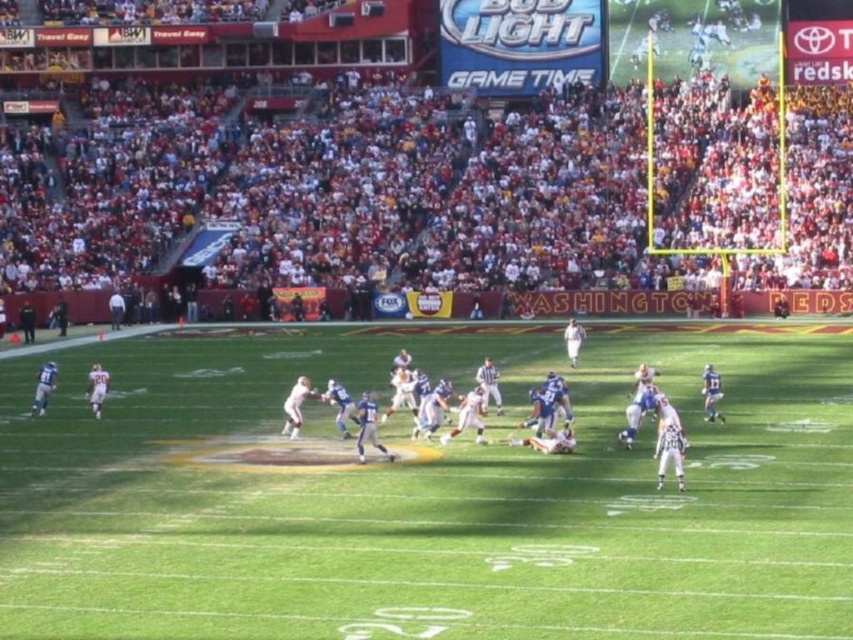
Is green grass football field at center positioned before white matte football players at center?

That is True.

Does green grass football field at center come behind white matte football players at center?

No, green grass football field at center is in front of white matte football players at center.

What do you see at coordinates (426, 493) in the screenshot? I see `green grass football field at center` at bounding box center [426, 493].

Find the location of a particular element. This screenshot has width=853, height=640. green grass football field at center is located at coordinates (426, 493).

Between green grass football field at center and white fabric crowd at upper center, which one has less height?

With less height is green grass football field at center.

Locate an element on the screen. green grass football field at center is located at coordinates (426, 493).

This screenshot has height=640, width=853. What do you see at coordinates (340, 188) in the screenshot? I see `white fabric crowd at upper center` at bounding box center [340, 188].

Is white fabric crowd at upper center taller than white matte football players at center?

Indeed, white fabric crowd at upper center has a greater height compared to white matte football players at center.

Is point (107, 132) farther from viewer compared to point (492, 368)?

Yes, it is behind point (492, 368).

You are a GUI agent. You are given a task and a screenshot of the screen. Output one action in this format:
    pyautogui.click(x=<x>, y=<y>)
    Task: Click on the white fabric crowd at upper center
    Image resolution: width=853 pixels, height=640 pixels.
    Given the screenshot: What is the action you would take?
    pyautogui.click(x=340, y=188)